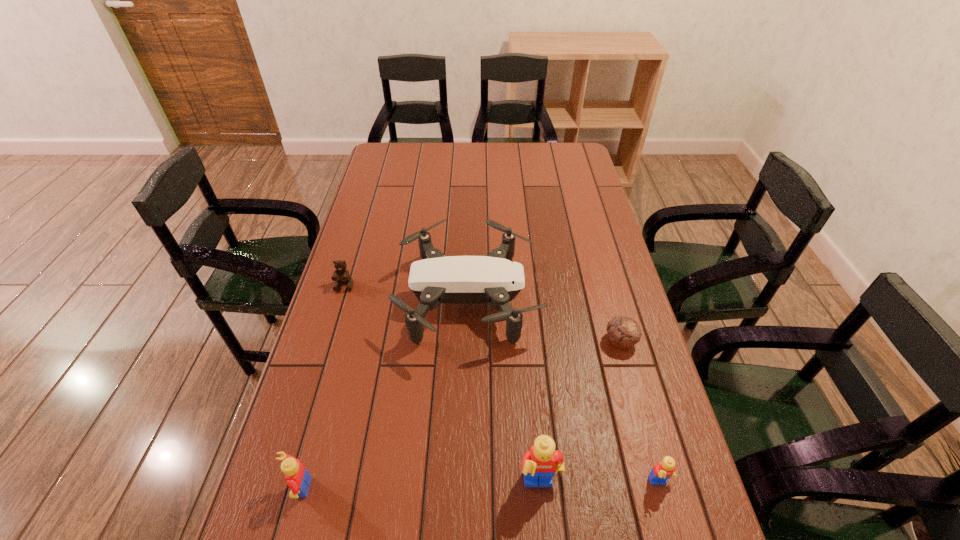
Where is `free space between the shortest Lego and the second tallest Lego`? The height and width of the screenshot is (540, 960). free space between the shortest Lego and the second tallest Lego is located at coordinates (479, 486).

You are a GUI agent. You are given a task and a screenshot of the screen. Output one action in this format:
    pyautogui.click(x=<x>, y=<y>)
    Task: Click on the vacant space that's between the muffin and the teddy bear
    This screenshot has width=960, height=540.
    Given the screenshot: What is the action you would take?
    pyautogui.click(x=482, y=313)

I want to click on free area in between the muffin and the leftmost Lego, so click(x=460, y=415).

At what (x,y) coordinates should I click in order to perform the action: click on the third closest object to the muffin. Please return your answer as a coordinate pair (x, y). The height and width of the screenshot is (540, 960). Looking at the image, I should click on (539, 464).

Locate an element on the screen. The image size is (960, 540). object that stands as the third closest to the drone is located at coordinates (539, 464).

Identify which Lego is the third nearest to the teddy bear. Please provide its 2D coordinates. Your answer should be formatted as a tuple, i.e. [(x, y)], where the tuple contains the x and y coordinates of a point satisfying the conditions above.

[(662, 471)]

In order to click on Lego that is the closest to the leftmost Lego in this screenshot , I will do `click(539, 464)`.

At what (x,y) coordinates should I click in order to perform the action: click on free region that satisfies the following two spatial constraints: 1. on the face of the tallest object; 2. on the face of the leftmost Lego. Please return your answer as a coordinate pair (x, y). Looking at the image, I should click on tap(540, 488).